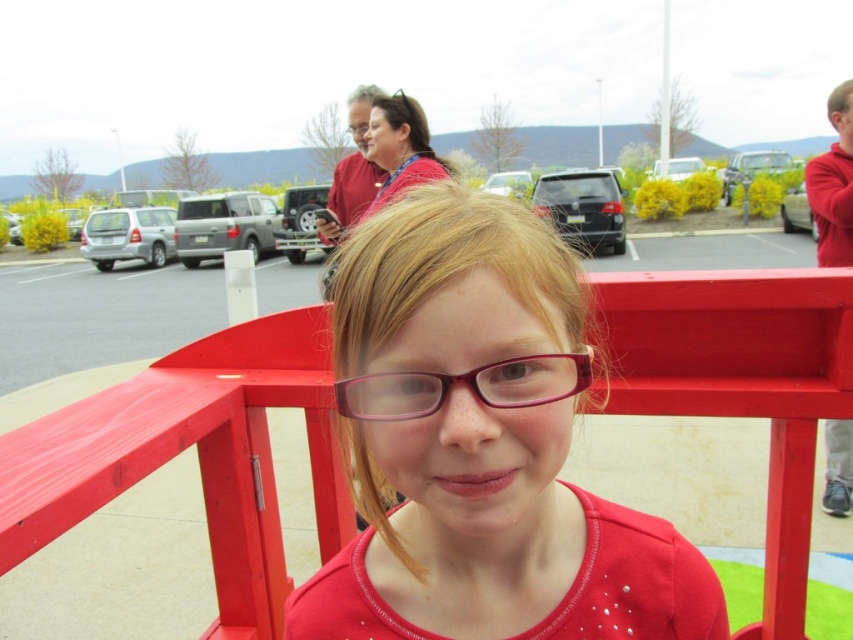
Looking at this image, you are a photographer trying to capture the pink plastic glasses at center without the matte plastic rail at center blocking the view. Based on the scene description, can you position yourself in a way to achieve this?

The pink plastic glasses at center is behind the matte plastic rail at center, so you can move around to the side of the matte plastic rail at center to get a clear view of the pink plastic glasses at center without obstruction.

You are at a park and see a matte plastic rail at center and pink plastic glasses at center. Which object is located to the left?

The matte plastic rail at center is positioned on the left side of the pink plastic glasses at center.

You are a visitor at this outdoor location and want to place a small decorative item on the matte plastic rail at center. However, there is already an object on the matte plastic glasses at center. Can you place your item on the rail without moving the existing object?

The matte plastic glasses at center is above the matte plastic rail at center, so the glasses are positioned higher up. Since the glasses are already above the rail, placing an item on the rail would not interfere with the existing object on the glasses.